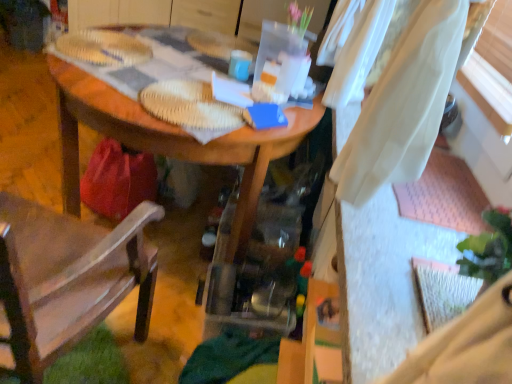
Question: Is wooden desk at center bigger than brown fabric chair at left?

Choices:
 (A) no
 (B) yes

Answer: (B)

Question: Is wooden desk at center positioned with its back to brown fabric chair at left?

Choices:
 (A) no
 (B) yes

Answer: (A)

Question: Is wooden desk at center to the right of brown fabric chair at left from the viewer's perspective?

Choices:
 (A) no
 (B) yes

Answer: (B)

Question: From the image's perspective, is wooden desk at center on brown fabric chair at left?

Choices:
 (A) no
 (B) yes

Answer: (B)

Question: Is wooden desk at center placed right next to brown fabric chair at left?

Choices:
 (A) yes
 (B) no

Answer: (B)

Question: Can you confirm if wooden desk at center is taller than brown fabric chair at left?

Choices:
 (A) no
 (B) yes

Answer: (A)

Question: Does brown fabric chair at left come behind wooden desk at center?

Choices:
 (A) no
 (B) yes

Answer: (A)

Question: Is brown fabric chair at left placed right next to wooden desk at center?

Choices:
 (A) yes
 (B) no

Answer: (B)

Question: From a real-world perspective, does brown fabric chair at left sit lower than wooden desk at center?

Choices:
 (A) no
 (B) yes

Answer: (A)

Question: From the image's perspective, is brown fabric chair at left above wooden desk at center?

Choices:
 (A) yes
 (B) no

Answer: (B)

Question: Is brown fabric chair at left located outside wooden desk at center?

Choices:
 (A) yes
 (B) no

Answer: (A)

Question: Is brown fabric chair at left turned away from wooden desk at center?

Choices:
 (A) no
 (B) yes

Answer: (A)

Question: Does brown fabric chair at left have a smaller size compared to matte blue mug at center?

Choices:
 (A) yes
 (B) no

Answer: (B)